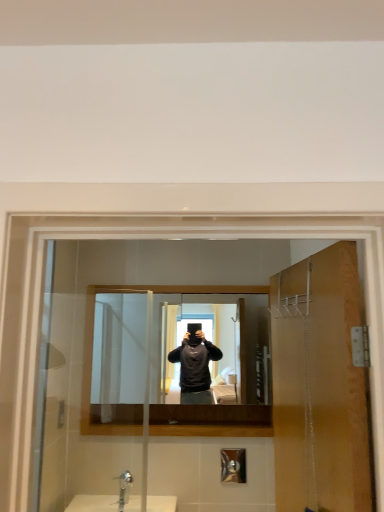
What do you see at coordinates (233, 465) in the screenshot? This screenshot has width=384, height=512. I see `brushed metal shower at lower center` at bounding box center [233, 465].

Locate an element on the screen. silver metallic faucet at lower center is located at coordinates (124, 488).

Is silver metallic faucet at lower center far from wooden door at right?

Absolutely, silver metallic faucet at lower center is distant from wooden door at right.

From the image's perspective, is silver metallic faucet at lower center positioned above or below wooden door at right?

Clearly, from the image's perspective, silver metallic faucet at lower center is below wooden door at right.

Is silver metallic faucet at lower center oriented away from wooden door at right?

No, wooden door at right is not at the back of silver metallic faucet at lower center.

Looking at this image, is silver metallic faucet at lower center located outside wooden door at right?

silver metallic faucet at lower center lies outside wooden door at right's area.

Is wooden door at right not close to matte black mirror at center?

That's right, there is a large distance between wooden door at right and matte black mirror at center.

Is point (285, 488) positioned in front of point (248, 303)?

That is True.

You are a GUI agent. You are given a task and a screenshot of the screen. Output one action in this format:
    pyautogui.click(x=<x>, y=<y>)
    Task: Click on the door in front of the matte black mirror at center
    
    Given the screenshot: What is the action you would take?
    320,386

Considering the positions of objects wooden door at right and matte black mirror at center in the image provided, who is behind, wooden door at right or matte black mirror at center?

matte black mirror at center.

From the image's perspective, is wooden door at right located above or below silver metallic faucet at lower center?

wooden door at right is situated higher than silver metallic faucet at lower center in the image.

Considering the relative sizes of wooden door at right and silver metallic faucet at lower center in the image provided, is wooden door at right shorter than silver metallic faucet at lower center?

No.

Is wooden door at right wider than silver metallic faucet at lower center?

Incorrect, the width of wooden door at right does not surpass that of silver metallic faucet at lower center.

Considering the relative sizes of wooden door at right and silver metallic faucet at lower center in the image provided, is wooden door at right smaller than silver metallic faucet at lower center?

Actually, wooden door at right might be larger than silver metallic faucet at lower center.

Considering the relative sizes of brushed metal shower at lower center and silver metallic faucet at lower center in the image provided, is brushed metal shower at lower center thinner than silver metallic faucet at lower center?

Yes.

Considering the relative sizes of brushed metal shower at lower center and silver metallic faucet at lower center in the image provided, is brushed metal shower at lower center taller than silver metallic faucet at lower center?

Indeed, brushed metal shower at lower center has a greater height compared to silver metallic faucet at lower center.

Is brushed metal shower at lower center located outside silver metallic faucet at lower center?

brushed metal shower at lower center is positioned outside silver metallic faucet at lower center.

Who is bigger, brushed metal shower at lower center or silver metallic faucet at lower center?

With larger size is silver metallic faucet at lower center.

From the image's perspective, between matte black mirror at center and brushed metal shower at lower center, which one is located above?

matte black mirror at center.

Considering the relative positions of matte black mirror at center and brushed metal shower at lower center in the image provided, is matte black mirror at center to the left or to the right of brushed metal shower at lower center?

Clearly, matte black mirror at center is on the left of brushed metal shower at lower center in the image.

Based on the photo, looking at their sizes, would you say matte black mirror at center is wider or thinner than brushed metal shower at lower center?

Clearly, matte black mirror at center has more width compared to brushed metal shower at lower center.

Locate an element on the screen. Image resolution: width=384 pixels, height=512 pixels. shower that is in front of the matte black mirror at center is located at coordinates click(x=233, y=465).

Would you say matte black mirror at center contains silver metallic faucet at lower center?

No, silver metallic faucet at lower center is located outside of matte black mirror at center.

Which object is further away from the camera, matte black mirror at center or silver metallic faucet at lower center?

Positioned behind is matte black mirror at center.

In terms of size, does matte black mirror at center appear bigger or smaller than silver metallic faucet at lower center?

Considering their sizes, matte black mirror at center takes up more space than silver metallic faucet at lower center.

Considering the relative sizes of matte black mirror at center and silver metallic faucet at lower center in the image provided, is matte black mirror at center shorter than silver metallic faucet at lower center?

No, matte black mirror at center is not shorter than silver metallic faucet at lower center.

Is silver metallic faucet at lower center spatially inside matte black mirror at center, or outside of it?

silver metallic faucet at lower center is spatially situated outside matte black mirror at center.

The width and height of the screenshot is (384, 512). I want to click on mirror above the silver metallic faucet at lower center (from a real-world perspective), so click(181, 348).

Is silver metallic faucet at lower center shorter than matte black mirror at center?

Indeed, silver metallic faucet at lower center has a lesser height compared to matte black mirror at center.

Is point (128, 486) positioned before point (104, 386)?

No, it is behind (104, 386).

Image resolution: width=384 pixels, height=512 pixels. What are the coordinates of `tap that is under the wooden door at right (from a real-world perspective)` in the screenshot? It's located at pyautogui.click(x=124, y=488).

The height and width of the screenshot is (512, 384). In order to click on mirror below the wooden door at right (from the image's perspective) in this screenshot , I will do `click(181, 348)`.

From the image, which object appears to be farther from wooden door at right, silver metallic faucet at lower center or brushed metal shower at lower center?

Among the two, brushed metal shower at lower center is located further to wooden door at right.

Based on the photo, based on their spatial positions, is brushed metal shower at lower center or wooden door at right closer to silver metallic faucet at lower center?

brushed metal shower at lower center is closer to silver metallic faucet at lower center.

Considering their positions, is brushed metal shower at lower center positioned closer to matte black mirror at center than silver metallic faucet at lower center?

The object closer to matte black mirror at center is brushed metal shower at lower center.

Which object lies further to the anchor point matte black mirror at center, silver metallic faucet at lower center or brushed metal shower at lower center?

Based on the image, silver metallic faucet at lower center appears to be further to matte black mirror at center.

In the scene shown: Looking at the image, which one is located closer to silver metallic faucet at lower center, matte black mirror at center or wooden door at right?

Among the two, matte black mirror at center is located nearer to silver metallic faucet at lower center.

Based on their spatial positions, is silver metallic faucet at lower center or wooden door at right closer to brushed metal shower at lower center?

Among the two, silver metallic faucet at lower center is located nearer to brushed metal shower at lower center.

When comparing their distances from wooden door at right, does brushed metal shower at lower center or matte black mirror at center seem closer?

matte black mirror at center.

Looking at the image, which one is located closer to wooden door at right, silver metallic faucet at lower center or matte black mirror at center?

matte black mirror at center.

At what (x,y) coordinates should I click in order to perform the action: click on tap between wooden door at right and matte black mirror at center along the z-axis. Please return your answer as a coordinate pair (x, y). The width and height of the screenshot is (384, 512). Looking at the image, I should click on (124, 488).

Where is `tap between wooden door at right and brushed metal shower at lower center from front to back`? The image size is (384, 512). tap between wooden door at right and brushed metal shower at lower center from front to back is located at coordinates (124, 488).

Where is `shower between wooden door at right and matte black mirror at center in the front-back direction`? shower between wooden door at right and matte black mirror at center in the front-back direction is located at coordinates [233, 465].

The image size is (384, 512). I want to click on shower that lies between matte black mirror at center and silver metallic faucet at lower center from top to bottom, so click(x=233, y=465).